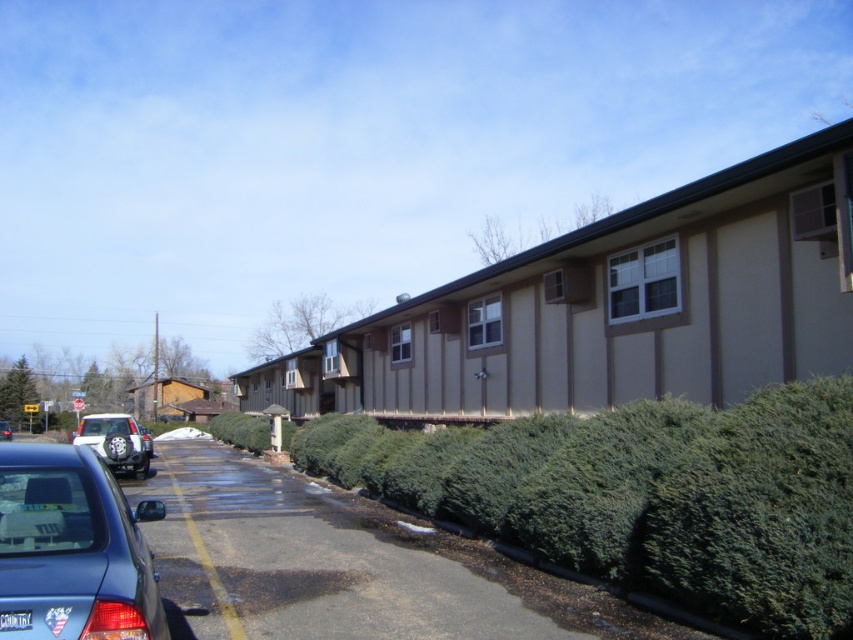
You are a delivery driver who needs to park your 4.5 meters long truck in this residential area. The truck is longer than the metallic blue sedan at lower left but shorter than the silver metallic suv at left. Can you park your truck between these two vehicles without overlapping them?

The metallic blue sedan at lower left is shorter than the silver metallic suv at left. Since your truck is longer than the metallic blue sedan at lower left but shorter than the silver metallic suv at left, there might be enough space between them to park. However, the exact feasibility depends on the distance between the two vehicles and the required clearance for the truck. Without specific measurements, it is uncertain if the truck can fit.

You are a delivery driver who needs to park your vehicle in the parking lot. You see a silver metallic suv at left and a metallic silver sedan at lower left. Which vehicle is positioned to the right side of the other?

The silver metallic suv at left is positioned to the right of the metallic silver sedan at lower left.

You are a delivery driver who needs to park your truck in the parking lot shown in the image. There are two vehicles blocking your path to the desired parking spot. The silver metallic suv at left and the metallic silver sedan at lower left are in your way. Can you drive around them to reach the spot?

The silver metallic suv at left is in front of the metallic silver sedan at lower left, so you can drive around the metallic silver sedan at lower left by going around the suv since it is closer to you.